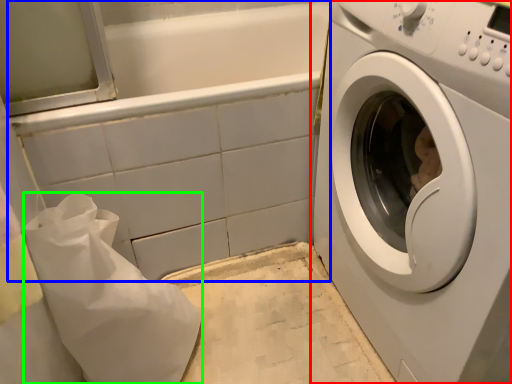
Question: Based on their relative distances, which object is farther from washing machine (highlighted by a red box)? Choose from bath (highlighted by a blue box) and material (highlighted by a green box).

Choices:
 (A) bath
 (B) material

Answer: (B)